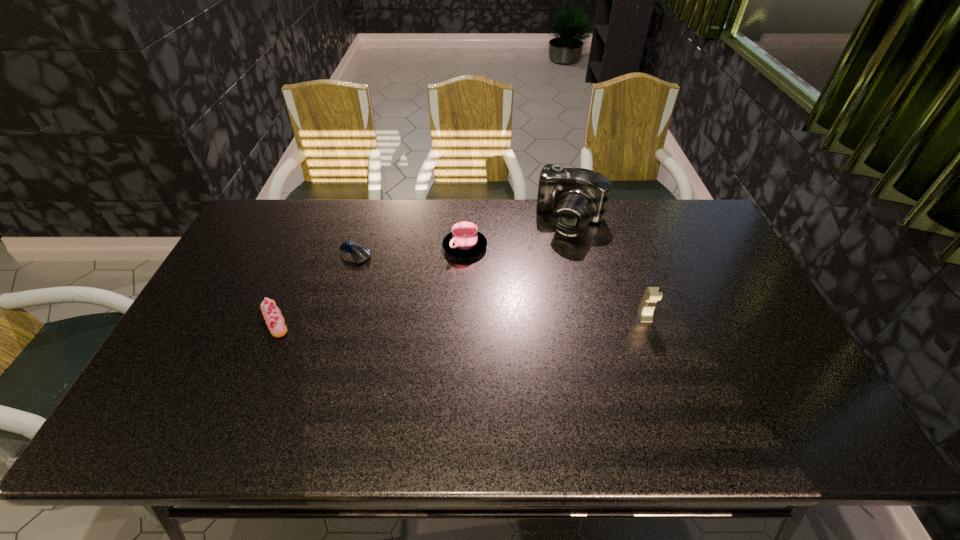
You are a GUI agent. You are given a task and a screenshot of the screen. Output one action in this format:
    pyautogui.click(x=<x>, y=<y>)
    Task: Click on the free space on the desktop that is between the fourth tallest object and the rightmost object and is positioned on the side with the handle of the third tallest object
    This screenshot has height=540, width=960.
    Given the screenshot: What is the action you would take?
    pyautogui.click(x=417, y=319)

Where is `free space on the desktop that is between the leftmost object and the cellular telephone and is positioned on the lens of the second object from right to left`? The image size is (960, 540). free space on the desktop that is between the leftmost object and the cellular telephone and is positioned on the lens of the second object from right to left is located at coordinates (513, 319).

Where is `free spot on the desktop that is between the leftmost object and the rightmost object and is positioned on the button side of the shortest object`? free spot on the desktop that is between the leftmost object and the rightmost object and is positioned on the button side of the shortest object is located at coordinates (450, 319).